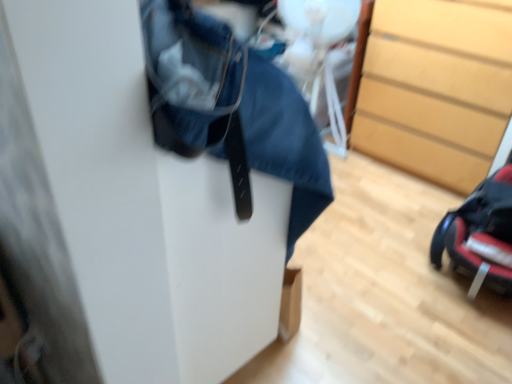
Question: Considering the positions of point (480, 205) and point (392, 157), is point (480, 205) closer or farther from the camera than point (392, 157)?

Choices:
 (A) farther
 (B) closer

Answer: (B)

Question: From their relative heights in the image, would you say black plastic baby carriage at lower right is taller or shorter than wooden chest of drawers at right?

Choices:
 (A) tall
 (B) short

Answer: (B)

Question: From a real-world perspective, is black plastic baby carriage at lower right above or below wooden chest of drawers at right?

Choices:
 (A) below
 (B) above

Answer: (A)

Question: Does point (496, 26) appear closer or farther from the camera than point (480, 249)?

Choices:
 (A) farther
 (B) closer

Answer: (A)

Question: In the image, is wooden chest of drawers at right positioned in front of or behind black plastic baby carriage at lower right?

Choices:
 (A) front
 (B) behind

Answer: (B)

Question: Would you say wooden chest of drawers at right is to the left or to the right of black plastic baby carriage at lower right in the picture?

Choices:
 (A) left
 (B) right

Answer: (B)

Question: Considering the positions of wooden chest of drawers at right and black plastic baby carriage at lower right in the image, is wooden chest of drawers at right taller or shorter than black plastic baby carriage at lower right?

Choices:
 (A) tall
 (B) short

Answer: (A)